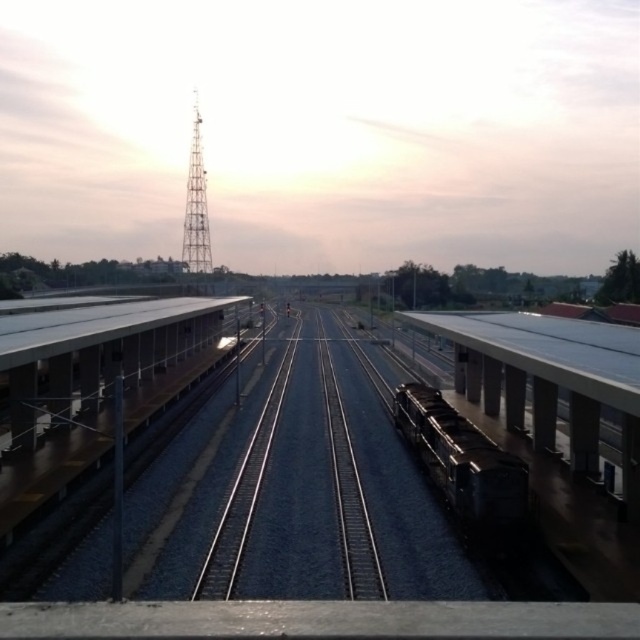
Who is lower down, metal/smooth train track at center or shiny black train at center?

metal/smooth train track at center is below.

In the scene shown: Is metal/smooth train track at center shorter than shiny black train at center?

Incorrect, metal/smooth train track at center's height does not fall short of shiny black train at center's.

This screenshot has width=640, height=640. Describe the element at coordinates (256, 481) in the screenshot. I see `metal/smooth train track at center` at that location.

Identify the location of metal/smooth train track at center. Image resolution: width=640 pixels, height=640 pixels. (256, 481).

Between shiny black train at center and metallic lattice tower at center, which one appears on the right side from the viewer's perspective?

shiny black train at center is more to the right.

Does shiny black train at center have a smaller size compared to metallic lattice tower at center?

Yes.

Between point (468, 484) and point (196, 225), which one is positioned in front?

Point (468, 484) is more forward.

Find the location of a particular element. Image resolution: width=640 pixels, height=640 pixels. shiny black train at center is located at coordinates coord(461,460).

Is metal/smooth train track at center in front of metallic lattice tower at center?

Yes.

Does metal/smooth train track at center appear on the right side of metallic lattice tower at center?

Indeed, metal/smooth train track at center is positioned on the right side of metallic lattice tower at center.

The height and width of the screenshot is (640, 640). Identify the location of metal/smooth train track at center. (256, 481).